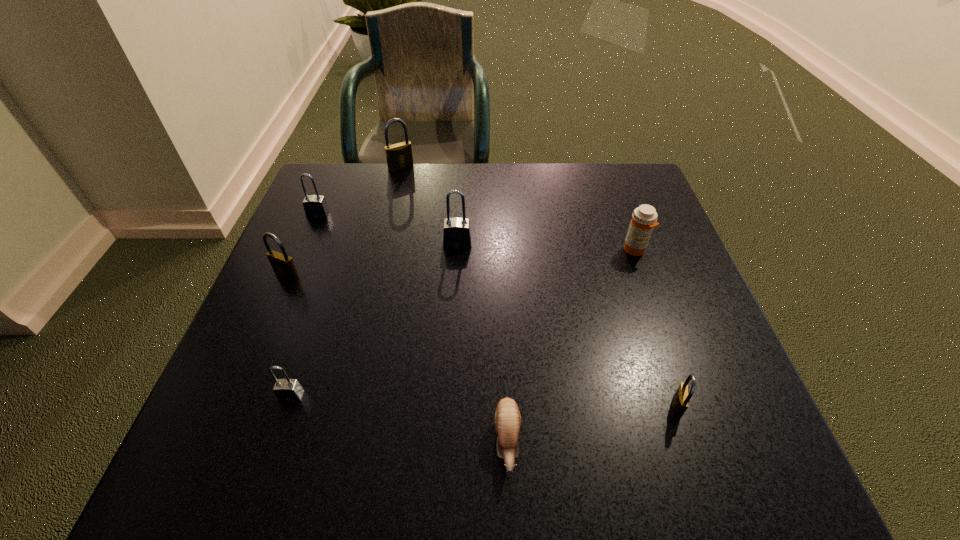
Identify the location of vacant space at the far left corner of the desktop. The image size is (960, 540). [x=319, y=167].

Locate an element on the screen. vacant space at the far right corner of the desktop is located at coordinates (597, 199).

Where is `free space that is in between the smallest gray padlock and the fourth nearest padlock`? The image size is (960, 540). free space that is in between the smallest gray padlock and the fourth nearest padlock is located at coordinates (374, 319).

You are a GUI agent. You are given a task and a screenshot of the screen. Output one action in this format:
    pyautogui.click(x=<x>, y=<y>)
    Task: Click on the free space that is in between the shortest object and the second farthest gray padlock
    
    Given the screenshot: What is the action you would take?
    pyautogui.click(x=482, y=343)

The image size is (960, 540). I want to click on vacant region between the smallest brass padlock and the second gray padlock from right to left, so click(x=484, y=401).

Find the location of a particular element. empty location between the nearest gray padlock and the second nearest gray padlock is located at coordinates (374, 319).

Image resolution: width=960 pixels, height=540 pixels. In order to click on vacant space that is in between the medicine and the nearest gray padlock in this screenshot , I will do `click(463, 323)`.

In order to click on vacant area that lies between the third padlock from right to left and the rightmost padlock in this screenshot , I will do `click(539, 288)`.

I want to click on blank region between the third object from left to right and the second biggest brass padlock, so click(289, 335).

The height and width of the screenshot is (540, 960). Identify the location of vacant space that's between the rightmost brass padlock and the medicine. (656, 329).